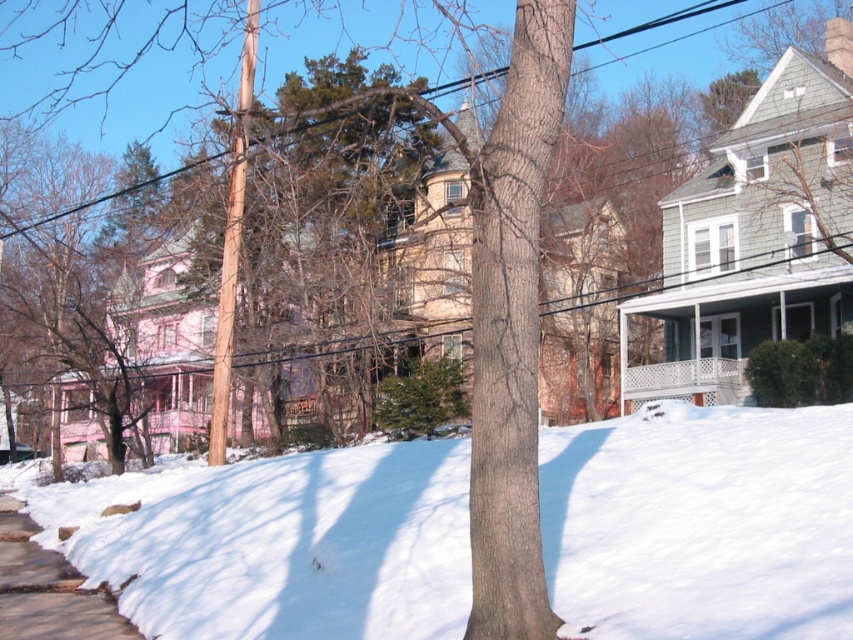
The height and width of the screenshot is (640, 853). I want to click on white fluffy snow at lower center, so click(x=280, y=544).

Can you confirm if white fluffy snow at lower center is positioned above smooth concrete sidewalk at lower left?

Correct, white fluffy snow at lower center is located above smooth concrete sidewalk at lower left.

This screenshot has width=853, height=640. Describe the element at coordinates (280, 544) in the screenshot. I see `white fluffy snow at lower center` at that location.

The image size is (853, 640). I want to click on white fluffy snow at lower center, so click(280, 544).